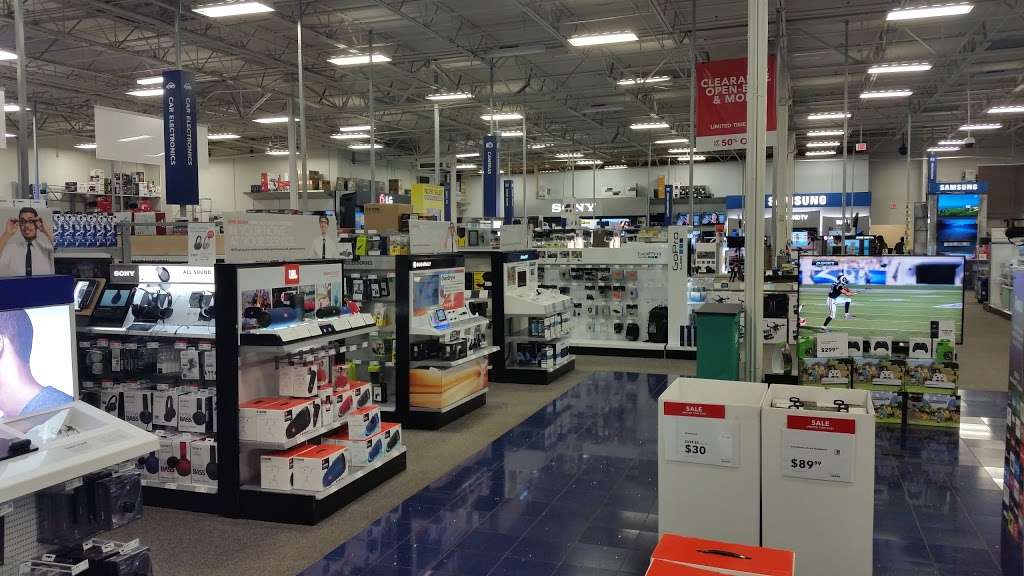
At what (x,y) coordinates should I click in order to perform the action: click on large white ceiling. Please return your answer as a coordinate pair (x, y). Image resolution: width=1024 pixels, height=576 pixels. Looking at the image, I should click on (498, 33).